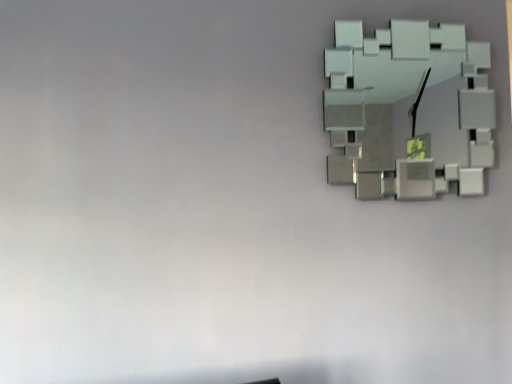
What is the approximate height of white matte clock at upper right?

It is 19.36 inches.

Describe the element at coordinates (409, 110) in the screenshot. This screenshot has width=512, height=384. I see `white matte clock at upper right` at that location.

At what (x,y) coordinates should I click in order to perform the action: click on white matte clock at upper right. Please return your answer as a coordinate pair (x, y). The image size is (512, 384). Looking at the image, I should click on (409, 110).

Find the location of `white matte clock at upper right`. white matte clock at upper right is located at coordinates (409, 110).